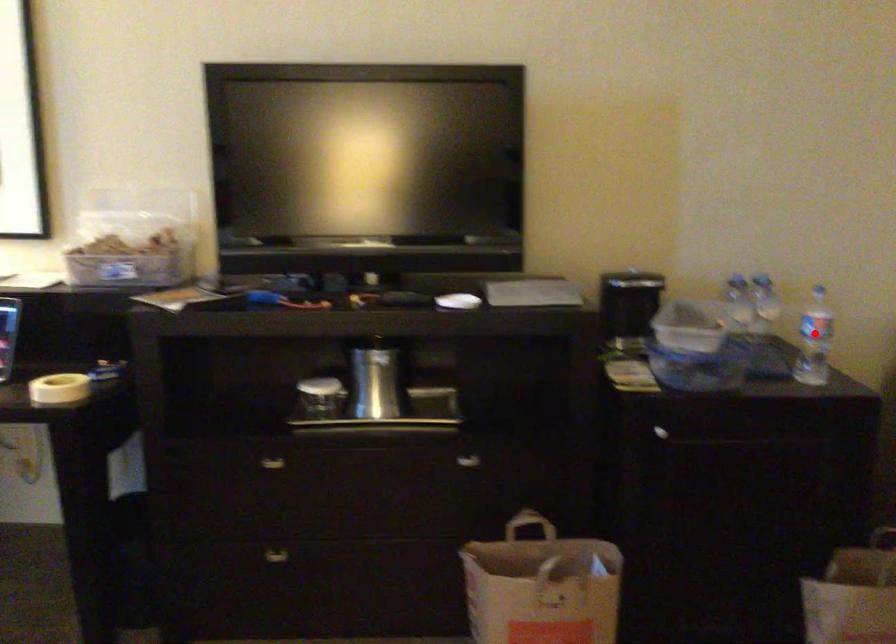
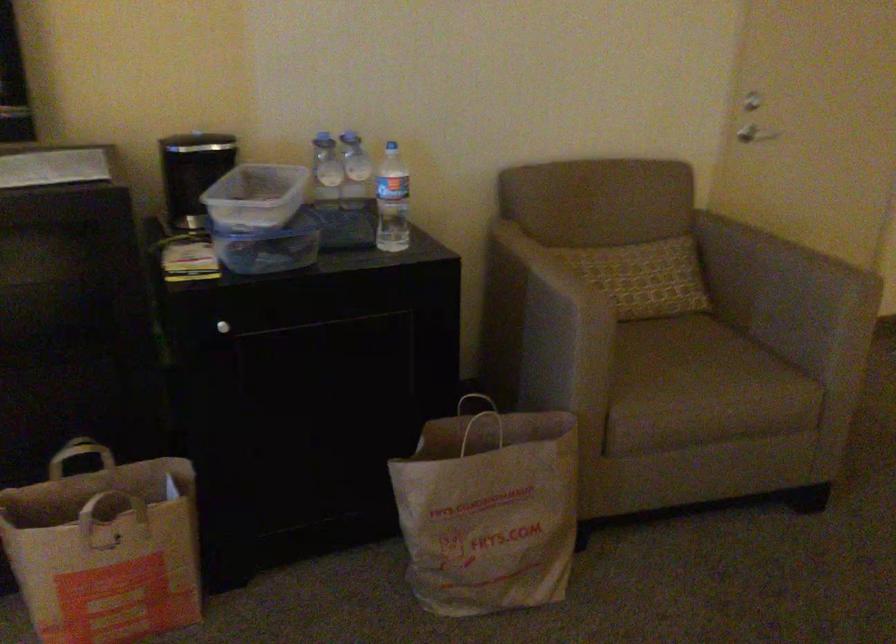
Find the pixel in the second image that matches the highlighted location in the first image.

(391, 201)